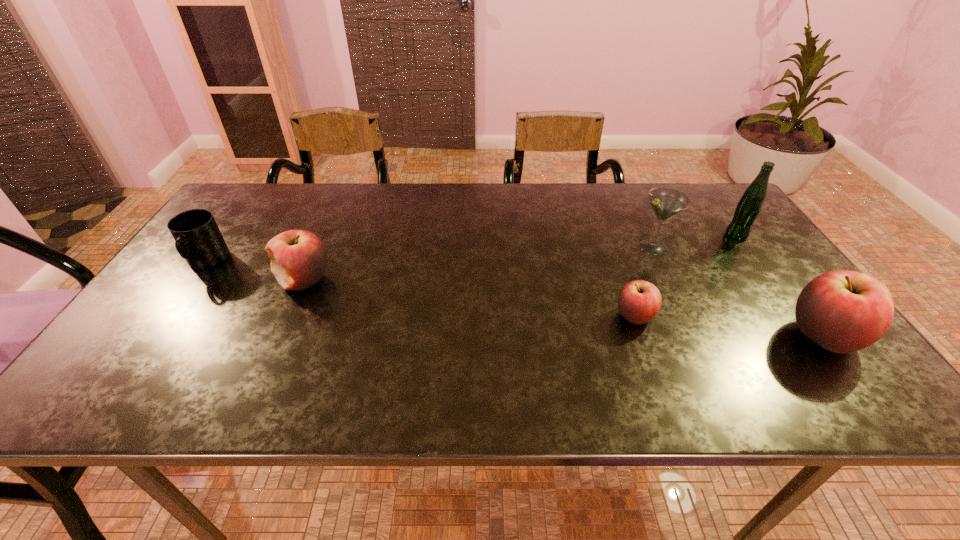
The width and height of the screenshot is (960, 540). What are the coordinates of `vacant point located between the rightmost apple and the tallest object` in the screenshot? It's located at (780, 286).

At what (x,y) coordinates should I click in order to perform the action: click on empty space that is in between the beer bottle and the fifth object from right to left. Please return your answer as a coordinate pair (x, y). The width and height of the screenshot is (960, 540). Looking at the image, I should click on (520, 258).

Identify the location of free space that is in between the beer bottle and the second shortest apple. (520, 258).

This screenshot has height=540, width=960. What are the coordinates of `vacant space that's between the tallest object and the rightmost apple` in the screenshot? It's located at (780, 286).

Identify the location of object that is the fourth closest to the fifth tallest object. This screenshot has width=960, height=540. (843, 311).

Locate which object is the third closest to the second apple from left to right. Please provide its 2D coordinates. Your answer should be formatted as a tuple, i.e. [(x, y)], where the tuple contains the x and y coordinates of a point satisfying the conditions above.

[(748, 208)]

Locate which apple ranks second in proximity to the tallest object. Please provide its 2D coordinates. Your answer should be formatted as a tuple, i.e. [(x, y)], where the tuple contains the x and y coordinates of a point satisfying the conditions above.

[(639, 301)]

Locate which apple ranks in proximity to the third object from right to left. Please provide its 2D coordinates. Your answer should be formatted as a tuple, i.e. [(x, y)], where the tuple contains the x and y coordinates of a point satisfying the conditions above.

[(639, 301)]

Where is `vacant area in the image that satisfies the following two spatial constraints: 1. on the side of the leftmost object with the handle; 2. on the left side of the shortest object`? The width and height of the screenshot is (960, 540). vacant area in the image that satisfies the following two spatial constraints: 1. on the side of the leftmost object with the handle; 2. on the left side of the shortest object is located at coordinates (168, 316).

The image size is (960, 540). I want to click on vacant space that satisfies the following two spatial constraints: 1. on the front side of the rightmost apple; 2. on the right side of the martini, so click(x=694, y=337).